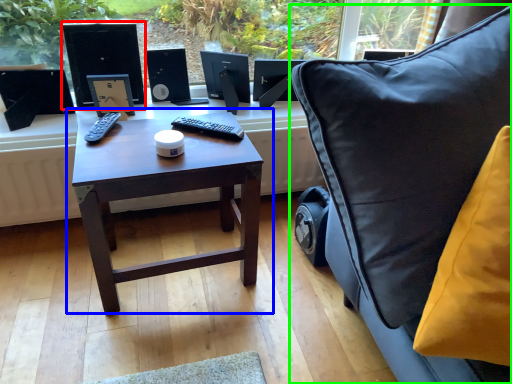
Question: Based on their relative distances, which object is farther from desktop computer (highlighted by a red box)? Choose from table (highlighted by a blue box) and chair (highlighted by a green box).

Choices:
 (A) table
 (B) chair

Answer: (B)